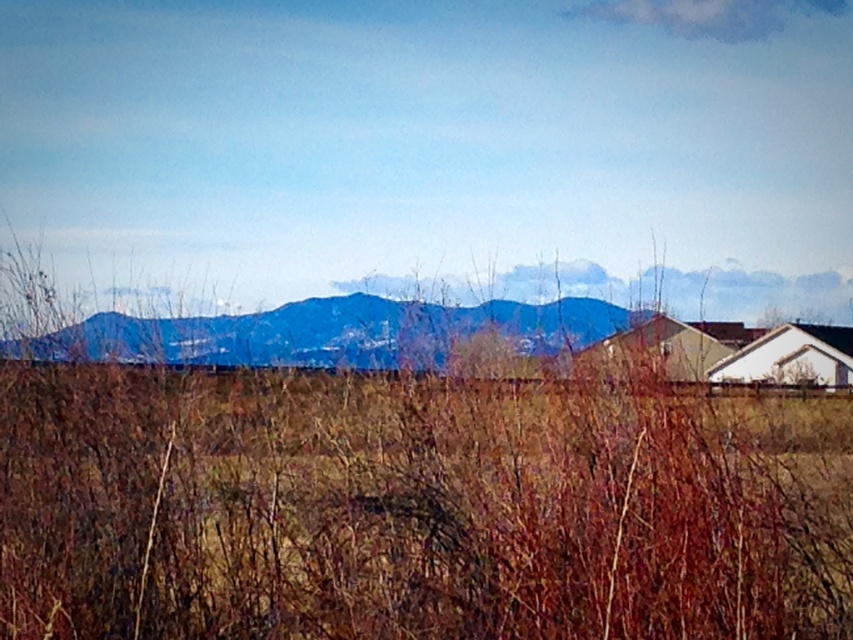
Question: Is brown dry grass at lower center behind blue matte mountain range at center?

Choices:
 (A) yes
 (B) no

Answer: (B)

Question: Does brown dry grass at lower center appear on the right side of blue matte mountain range at center?

Choices:
 (A) no
 (B) yes

Answer: (B)

Question: Is brown dry grass at lower center below blue matte mountain range at center?

Choices:
 (A) yes
 (B) no

Answer: (A)

Question: Which object appears closest to the camera in this image?

Choices:
 (A) blue matte mountain range at center
 (B) brown dry grass at lower center

Answer: (B)

Question: Which point is farther from the camera taking this photo?

Choices:
 (A) (242, 332)
 (B) (303, 403)

Answer: (A)